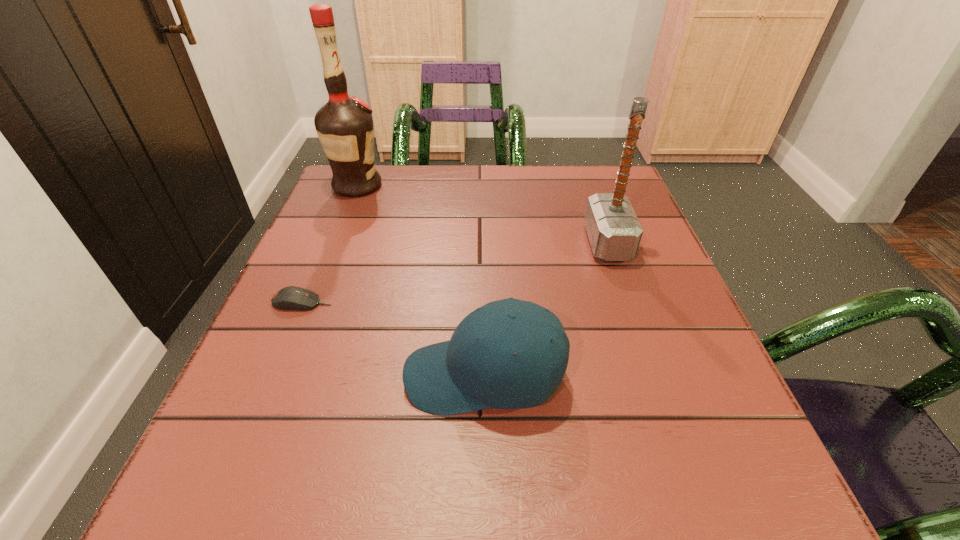
Where is `object that is at the far left corner`? This screenshot has height=540, width=960. object that is at the far left corner is located at coordinates (344, 125).

Image resolution: width=960 pixels, height=540 pixels. What are the coordinates of `free space at the far edge of the desktop` in the screenshot? It's located at (531, 198).

This screenshot has height=540, width=960. In the image, there is a desktop. Find the location of `vacant space at the near edge`. vacant space at the near edge is located at coordinates (633, 458).

Image resolution: width=960 pixels, height=540 pixels. Find the location of `vacant region at the left edge of the desktop`. vacant region at the left edge of the desktop is located at coordinates [288, 272].

Identify the location of free point at the right edge. (705, 370).

The height and width of the screenshot is (540, 960). In order to click on free space at the far left corner of the desktop in this screenshot , I will do `click(397, 172)`.

At what (x,y) coordinates should I click in order to perform the action: click on vacant space at the near left corner. Please return your answer as a coordinate pair (x, y). Looking at the image, I should click on (191, 516).

In the image, there is a desktop. Where is `vacant space at the far right corner`? vacant space at the far right corner is located at coordinates (589, 182).

At what (x,y) coordinates should I click in order to perform the action: click on free space between the farthest object and the hammer. Please return your answer as a coordinate pair (x, y). Looking at the image, I should click on (482, 214).

Identify the location of blank region between the tallest object and the nearest object. (420, 281).